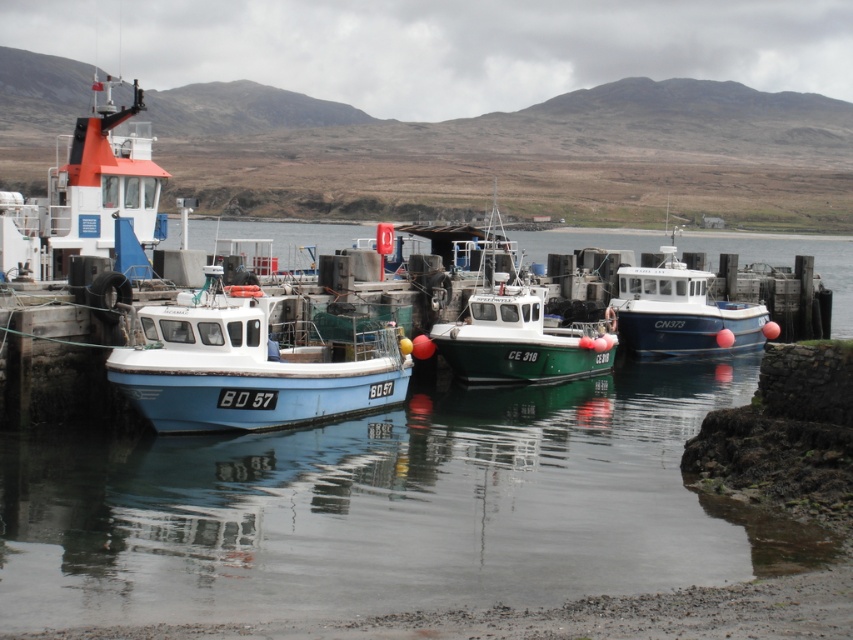
Question: Is light blue matte boat at center wider than blue glossy boat at center?

Choices:
 (A) no
 (B) yes

Answer: (A)

Question: Based on their relative distances, which object is farther from the blue glossy boat at center?

Choices:
 (A) clear water at center
 (B) light blue matte boat at center
 (C) green matte boat at center

Answer: (B)

Question: Which of the following is the closest to the observer?

Choices:
 (A) (496, 248)
 (B) (265, 428)
 (C) (666, 324)

Answer: (B)

Question: Is green matte boat at center below blue glossy boat at center?

Choices:
 (A) yes
 (B) no

Answer: (B)

Question: Which is nearer to the light blue matte boat at center?

Choices:
 (A) blue glossy boat at center
 (B) clear water at center
 (C) green matte boat at center

Answer: (B)

Question: Observing the image, what is the correct spatial positioning of clear water at center in reference to green matte boat at center?

Choices:
 (A) right
 (B) left

Answer: (B)